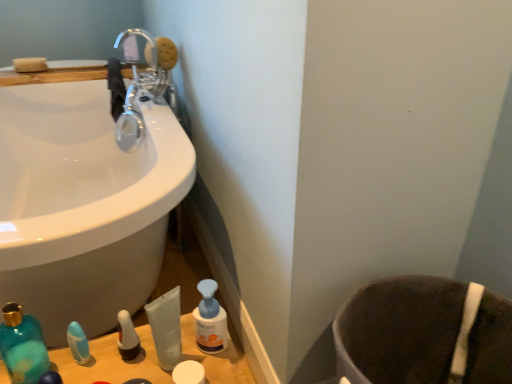
Where is `matte plastic bottles at lower left`? Image resolution: width=512 pixels, height=384 pixels. matte plastic bottles at lower left is located at coordinates (111, 362).

Describe the element at coordinates (111, 362) in the screenshot. Image resolution: width=512 pixels, height=384 pixels. I see `matte plastic bottles at lower left` at that location.

Find the location of a particular element. Image resolution: width=512 pixels, height=384 pixels. translucent plastic pump bottle at lower left, positioned as the second toiletry in left-to-right order is located at coordinates (127, 337).

What is the approximate width of chrome metallic faucet at upper left?

chrome metallic faucet at upper left is 11.60 inches wide.

Measure the distance between point (117, 45) and camera.

Point (117, 45) and camera are 2.18 meters apart from each other.

The image size is (512, 384). What do you see at coordinates (210, 320) in the screenshot?
I see `blue plastic pump bottle at lower center` at bounding box center [210, 320].

In order to face blue plastic pump bottle at lower center, should I rotate leftwards or rightwards?

To face it directly, rotate left by 6.303 degrees.

Measure the distance between translucent plastic tube at lower center, which is the second toiletry from right to left, and camera.

A distance of 30.77 inches exists between translucent plastic tube at lower center, which is the second toiletry from right to left, and camera.

Where is `blue glossy tube at lower left, positioned as the 1th toiletry in left-to-right order`? blue glossy tube at lower left, positioned as the 1th toiletry in left-to-right order is located at coordinates (78, 343).

From a real-world perspective, between brown fabric toilet bowl at lower right and teal glass mouthwash at lower left, who is vertically higher?

teal glass mouthwash at lower left.

From the image's perspective, is brown fabric toilet bowl at lower right under teal glass mouthwash at lower left?

Indeed, from the image's perspective, brown fabric toilet bowl at lower right is shown beneath teal glass mouthwash at lower left.

Between brown fabric toilet bowl at lower right and teal glass mouthwash at lower left, which one has less height?

With less height is teal glass mouthwash at lower left.

Who is taller, chrome metallic faucet at upper left or translucent plastic pump bottle at lower left, positioned as the second toiletry in left-to-right order?

chrome metallic faucet at upper left.

Choose the correct answer: Is chrome metallic faucet at upper left inside translucent plastic pump bottle at lower left, positioned as the second toiletry in left-to-right order, or outside it?

The correct answer is: outside.

Which object is positioned more to the right, chrome metallic faucet at upper left or translucent plastic pump bottle at lower left, positioned as the second toiletry in left-to-right order?

translucent plastic pump bottle at lower left, positioned as the second toiletry in left-to-right order, is more to the right.

How many degrees apart are the facing directions of chrome metallic faucet at upper left and translucent plastic pump bottle at lower left, the third toiletry positioned from the right?

There is a 3.27-degree angle between the facing directions of chrome metallic faucet at upper left and translucent plastic pump bottle at lower left, the third toiletry positioned from the right.

This screenshot has height=384, width=512. There is a blue plastic pump bottle at lower center. In order to click on the 1st toiletry below it (from a real-world perspective) in this screenshot , I will do `click(127, 337)`.

Could you measure the distance between blue plastic pump bottle at lower center and translucent plastic pump bottle at lower left, positioned as the second toiletry in left-to-right order?

5.86 inches.

Considering the positions of objects blue plastic pump bottle at lower center and translucent plastic pump bottle at lower left, positioned as the second toiletry in left-to-right order, in the image provided, who is more to the right, blue plastic pump bottle at lower center or translucent plastic pump bottle at lower left, positioned as the second toiletry in left-to-right order,?

blue plastic pump bottle at lower center.

Is blue plastic pump bottle at lower center next to translucent plastic pump bottle at lower left, positioned as the second toiletry in left-to-right order?

No, blue plastic pump bottle at lower center is not with translucent plastic pump bottle at lower left, positioned as the second toiletry in left-to-right order.

Between matte plastic bottles at lower left and white matte container at lower center, the 1th toiletry in the right-to-left sequence, which one has smaller width?

With smaller width is white matte container at lower center, the 1th toiletry in the right-to-left sequence.

Does matte plastic bottles at lower left turn towards white matte container at lower center, the 4th toiletry when ordered from left to right?

No, matte plastic bottles at lower left is not facing towards white matte container at lower center, the 4th toiletry when ordered from left to right.

From the picture: Which is further, (124, 370) or (176, 366)?

Positioned behind is point (124, 370).

Who is shorter, matte plastic bottles at lower left or white matte container at lower center, the 4th toiletry when ordered from left to right?

Standing shorter between the two is white matte container at lower center, the 4th toiletry when ordered from left to right.

Is black fabric hand towel at upper left not close to brown fabric toilet bowl at lower right?

Yes, black fabric hand towel at upper left and brown fabric toilet bowl at lower right are quite far apart.

In the image, is black fabric hand towel at upper left on the left side or the right side of brown fabric toilet bowl at lower right?

black fabric hand towel at upper left is positioned on brown fabric toilet bowl at lower right's left side.

Does point (120, 73) come farther from viewer compared to point (374, 337)?

Yes, point (120, 73) is behind point (374, 337).

Is black fabric hand towel at upper left positioned before brown fabric toilet bowl at lower right?

No, black fabric hand towel at upper left is behind brown fabric toilet bowl at lower right.

Which object is closer to the camera taking this photo, black fabric hand towel at upper left or matte plastic bottles at lower left?

matte plastic bottles at lower left.

Who is bigger, black fabric hand towel at upper left or matte plastic bottles at lower left?

With larger size is matte plastic bottles at lower left.

Considering the positions of point (116, 98) and point (208, 375), is point (116, 98) closer or farther from the camera than point (208, 375)?

Point (116, 98) is farther from the camera than point (208, 375).

Consider the image. Is black fabric hand towel at upper left turned away from matte plastic bottles at lower left?

No, black fabric hand towel at upper left is not facing the opposite direction of matte plastic bottles at lower left.

Who is more distant, black fabric hand towel at upper left or translucent plastic pump bottle at lower left, the third toiletry positioned from the right?

black fabric hand towel at upper left is further from the camera.

Is black fabric hand towel at upper left at the right side of translucent plastic pump bottle at lower left, positioned as the second toiletry in left-to-right order?

No.

Could you tell me if black fabric hand towel at upper left is turned towards translucent plastic pump bottle at lower left, the third toiletry positioned from the right?

No, black fabric hand towel at upper left is not aimed at translucent plastic pump bottle at lower left, the third toiletry positioned from the right.

Looking at the image, does black fabric hand towel at upper left seem bigger or smaller compared to translucent plastic pump bottle at lower left, the third toiletry positioned from the right?

In the image, black fabric hand towel at upper left appears to be larger than translucent plastic pump bottle at lower left, the third toiletry positioned from the right.

Identify the location of mouthwash above the brown fabric toilet bowl at lower right (from a real-world perspective). The width and height of the screenshot is (512, 384). (22, 346).

From the image's perspective, starting from the chrome metallic faucet at upper left, which toiletry is the 2nd one below? Please provide its 2D coordinates.

[(127, 337)]

Considering their positions, is blue glossy tube at lower left, arranged as the 4th toiletry when viewed from the right, positioned closer to blue plastic pump bottle at lower center than matte plastic bottles at lower left?

Among the two, matte plastic bottles at lower left is located nearer to blue plastic pump bottle at lower center.

Considering their positions, is brown fabric toilet bowl at lower right positioned further to translucent plastic tube at lower center, the 3th toiletry viewed from the left, than black fabric hand towel at upper left?

black fabric hand towel at upper left is positioned further to the anchor translucent plastic tube at lower center, the 3th toiletry viewed from the left.

Considering their positions, is brown fabric toilet bowl at lower right positioned further to matte plastic bottles at lower left than teal glass mouthwash at lower left?

Among the two, brown fabric toilet bowl at lower right is located further to matte plastic bottles at lower left.

Based on the photo, considering their positions, is chrome metallic faucet at upper left positioned closer to black fabric hand towel at upper left than brown fabric toilet bowl at lower right?

chrome metallic faucet at upper left is positioned closer to the anchor black fabric hand towel at upper left.

Looking at the image, which one is located further to teal glass mouthwash at lower left, translucent plastic tube at lower center, which is the second toiletry from right to left, or blue plastic pump bottle at lower center?

blue plastic pump bottle at lower center lies further to teal glass mouthwash at lower left than the other object.

From the image, which object appears to be farther from blue plastic pump bottle at lower center, brown fabric toilet bowl at lower right or chrome metallic faucet at upper left?

chrome metallic faucet at upper left is positioned further to the anchor blue plastic pump bottle at lower center.

Considering their positions, is brown fabric toilet bowl at lower right positioned closer to black fabric hand towel at upper left than chrome metallic faucet at upper left?

chrome metallic faucet at upper left is closer to black fabric hand towel at upper left.

Considering their positions, is black fabric hand towel at upper left positioned further to translucent plastic tube at lower center, the 3th toiletry viewed from the left, than chrome metallic faucet at upper left?

black fabric hand towel at upper left.

The height and width of the screenshot is (384, 512). In order to click on tap located between white matte container at lower center, the 1th toiletry in the right-to-left sequence, and black fabric hand towel at upper left in the depth direction in this screenshot , I will do `click(142, 83)`.

Where is `cleaning product located between white matte container at lower center, the 4th toiletry when ordered from left to right, and brown fabric toilet bowl at lower right in the left-right direction`? cleaning product located between white matte container at lower center, the 4th toiletry when ordered from left to right, and brown fabric toilet bowl at lower right in the left-right direction is located at coordinates (210, 320).

Where is `cleaning product between chrome metallic faucet at upper left and translucent plastic tube at lower center, which is the second toiletry from right to left, from top to bottom`? This screenshot has height=384, width=512. cleaning product between chrome metallic faucet at upper left and translucent plastic tube at lower center, which is the second toiletry from right to left, from top to bottom is located at coordinates (210, 320).

Find the location of `toiletry between translucent plastic pump bottle at lower left, the third toiletry positioned from the right, and white matte container at lower center, the 1th toiletry in the right-to-left sequence`. toiletry between translucent plastic pump bottle at lower left, the third toiletry positioned from the right, and white matte container at lower center, the 1th toiletry in the right-to-left sequence is located at coordinates (166, 328).